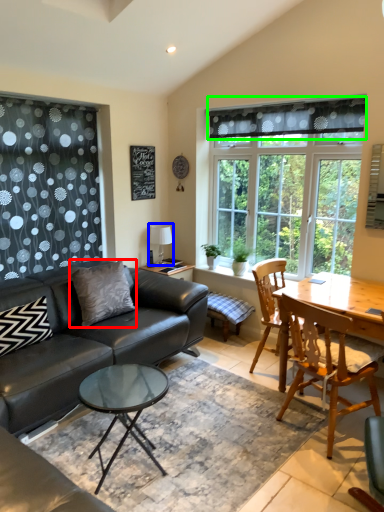
Question: Which is nearer to the pillow (highlighted by a red box)? lamp (highlighted by a blue box) or curtain (highlighted by a green box).

Choices:
 (A) lamp
 (B) curtain

Answer: (A)